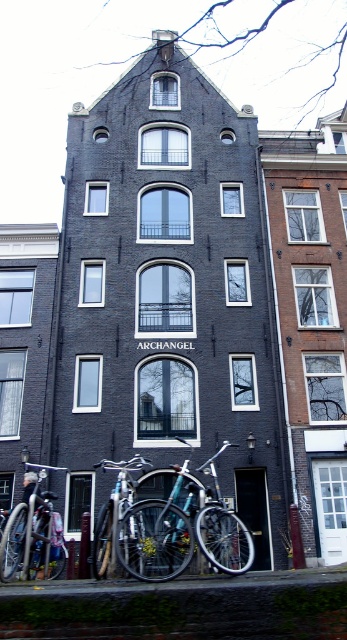
The image size is (347, 640). Describe the element at coordinates (32, 536) in the screenshot. I see `shiny metallic bicycle at lower left` at that location.

Which is behind, point (47, 536) or point (127, 484)?

The point (127, 484) is behind.

Does point (39, 528) come in front of point (104, 554)?

That is False.

Locate an element on the screen. The image size is (347, 640). shiny metallic bicycle at lower left is located at coordinates (32, 536).

Consider the image. Between shiny metallic bicycle at center and shiny metallic bicycle at lower left, which one has more height?

With more height is shiny metallic bicycle at lower left.

Can you confirm if shiny metallic bicycle at center is smaller than shiny metallic bicycle at lower left?

Incorrect, shiny metallic bicycle at center is not smaller in size than shiny metallic bicycle at lower left.

Which is behind, point (241, 540) or point (14, 524)?

Point (241, 540)

Where is `shiny metallic bicycle at center`? shiny metallic bicycle at center is located at coordinates click(182, 531).

This screenshot has height=640, width=347. What do you see at coordinates (182, 531) in the screenshot?
I see `shiny metallic bicycle at center` at bounding box center [182, 531].

Consider the image. Which of these two, shiny metallic bicycle at center or shiny metallic bicycle at lower center, stands taller?

shiny metallic bicycle at lower center is taller.

What are the coordinates of `shiny metallic bicycle at center` in the screenshot? It's located at (182, 531).

The width and height of the screenshot is (347, 640). I want to click on shiny metallic bicycle at center, so click(x=182, y=531).